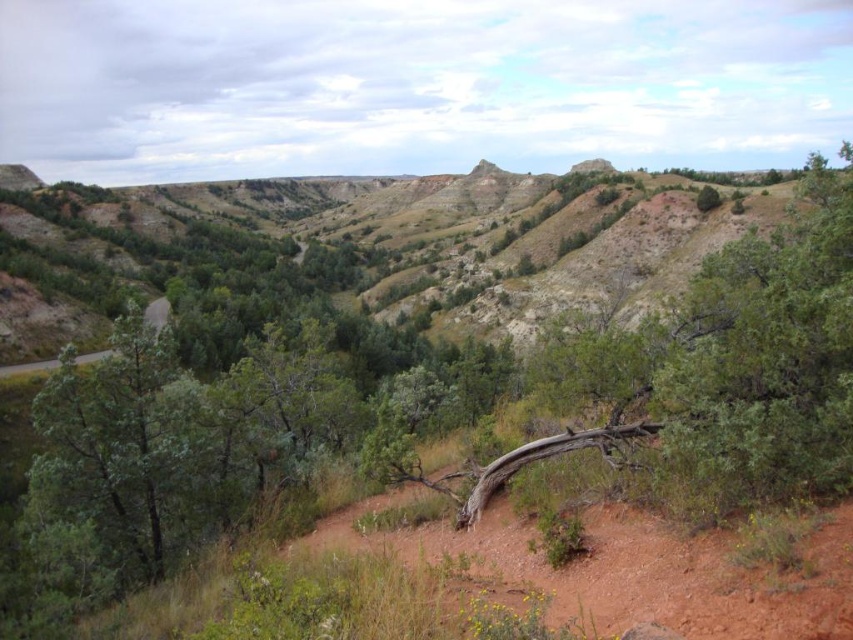
Question: Is brown rough tree trunk at center wider than brown dirt track at center?

Choices:
 (A) yes
 (B) no

Answer: (A)

Question: Which point is closer to the camera?

Choices:
 (A) (503, 515)
 (B) (531, 452)

Answer: (B)

Question: Is brown rough tree trunk at center behind brown dirt track at center?

Choices:
 (A) yes
 (B) no

Answer: (A)

Question: Is brown rough tree trunk at center above brown dirt track at center?

Choices:
 (A) yes
 (B) no

Answer: (A)